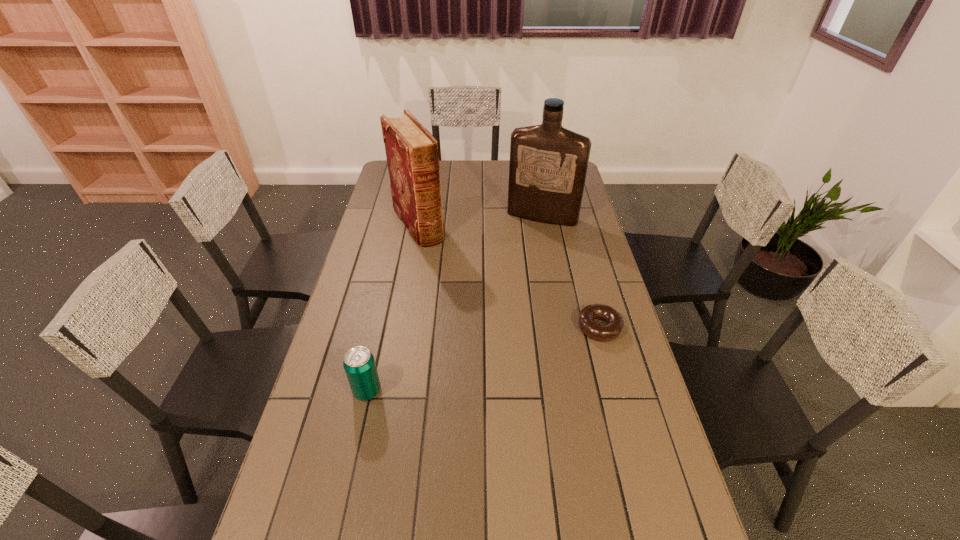
At what (x,y) coordinates should I click in order to perform the action: click on free space located 0.130m on the label side of the liquor. Please return your answer as a coordinate pair (x, y). This screenshot has height=540, width=960. Looking at the image, I should click on (525, 246).

I want to click on blank space located 0.300m on the spine side of the second tallest object, so click(461, 293).

You are a GUI agent. You are given a task and a screenshot of the screen. Output one action in this format:
    pyautogui.click(x=<x>, y=<y>)
    Task: Click on the vacant area situated 0.140m on the spine side of the second tallest object
    This screenshot has width=960, height=540.
    Given the screenshot: What is the action you would take?
    pyautogui.click(x=442, y=266)

Locate an element on the screen. vacant space situated 0.160m on the spine side of the second tallest object is located at coordinates (444, 269).

The width and height of the screenshot is (960, 540). Find the location of `beer can that is at the left edge`. beer can that is at the left edge is located at coordinates tap(359, 364).

You are a GUI agent. You are given a task and a screenshot of the screen. Output one action in this format:
    pyautogui.click(x=<x>, y=<y>)
    Task: Click on the hardback book positioned at the left edge
    This screenshot has height=540, width=960.
    Given the screenshot: What is the action you would take?
    pyautogui.click(x=412, y=154)

Where is `doughnut at the right edge`? doughnut at the right edge is located at coordinates pyautogui.click(x=615, y=323).

Image resolution: width=960 pixels, height=540 pixels. Identify the location of liquor that is at the right edge. (548, 164).

In the image, there is a desktop. Find the location of `free region at the far edge`. free region at the far edge is located at coordinates (496, 163).

This screenshot has width=960, height=540. In the image, there is a desktop. What are the coordinates of `free space at the near edge` in the screenshot? It's located at (577, 535).